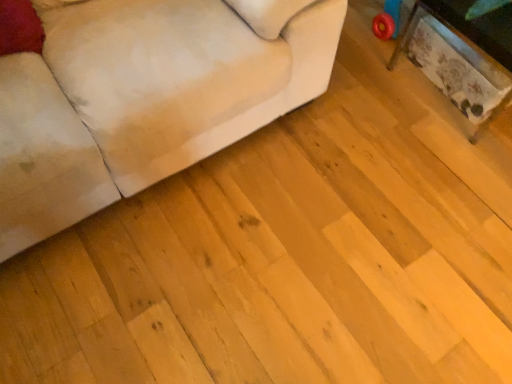
Question: From a real-world perspective, is suede-like beige couch at lower left physically located above or below wooden textured table at right?

Choices:
 (A) below
 (B) above

Answer: (B)

Question: Looking at the image, does suede-like beige couch at lower left seem bigger or smaller compared to wooden textured table at right?

Choices:
 (A) big
 (B) small

Answer: (A)

Question: Relative to wooden textured table at right, is suede-like beige couch at lower left in front or behind?

Choices:
 (A) behind
 (B) front

Answer: (B)

Question: Would you say wooden textured table at right is inside or outside suede-like beige couch at lower left?

Choices:
 (A) outside
 (B) inside

Answer: (A)

Question: Is wooden textured table at right in front of or behind suede-like beige couch at lower left in the image?

Choices:
 (A) behind
 (B) front

Answer: (A)

Question: From the image's perspective, is wooden textured table at right positioned above or below suede-like beige couch at lower left?

Choices:
 (A) below
 (B) above

Answer: (B)

Question: Based on their positions, is wooden textured table at right located to the left or right of suede-like beige couch at lower left?

Choices:
 (A) right
 (B) left

Answer: (A)